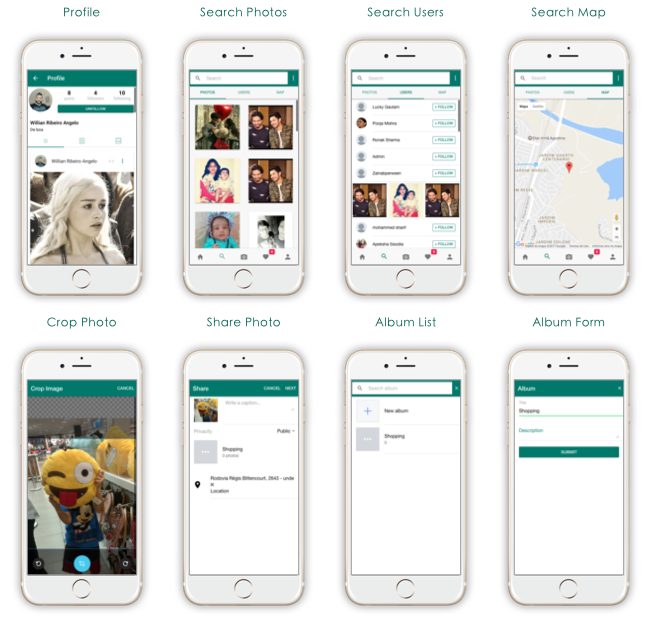
Identify the location of phone screen. (49, 131), (67, 480), (283, 409), (290, 156), (381, 169), (396, 519), (578, 463), (589, 174).